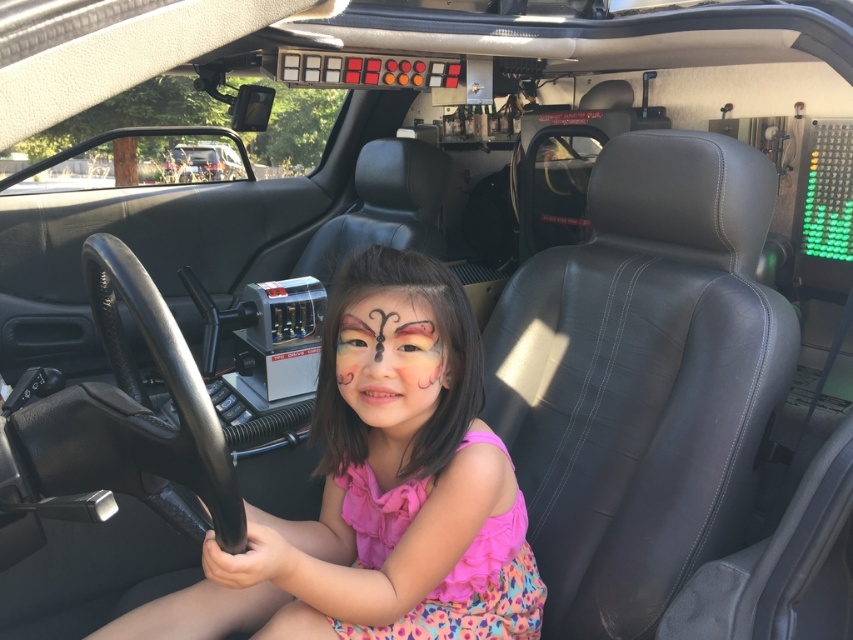
Question: Which of these objects is positioned closest to the metallic silver car at upper center?

Choices:
 (A) pink fabric dress at center
 (B) matte pink face paint at center

Answer: (A)

Question: Does pastel pink face paint at center appear on the right side of matte pink face paint at center?

Choices:
 (A) no
 (B) yes

Answer: (B)

Question: Does pink fabric dress at center have a greater width compared to metallic silver car at upper center?

Choices:
 (A) no
 (B) yes

Answer: (B)

Question: Which point is farther to the camera?

Choices:
 (A) (469, 481)
 (B) (354, 368)
 (C) (412, 324)
 (D) (167, 177)

Answer: (D)

Question: Which point appears closest to the camera in this image?

Choices:
 (A) (430, 337)
 (B) (171, 170)
 (C) (409, 323)
 (D) (457, 605)

Answer: (C)

Question: Can you confirm if pink fabric dress at center is positioned below metallic silver car at upper center?

Choices:
 (A) no
 (B) yes

Answer: (B)